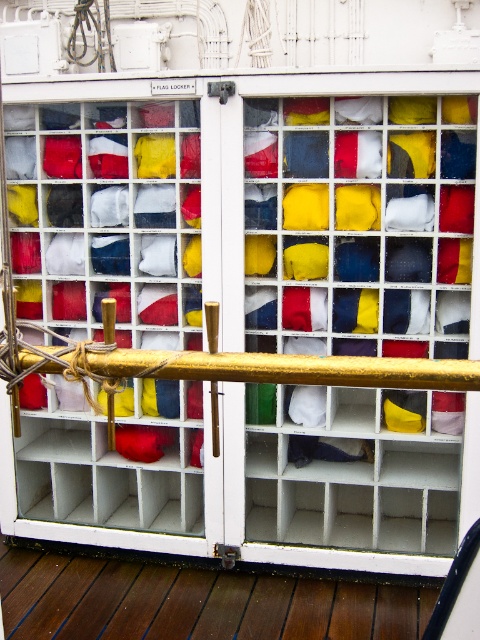
Question: Can you confirm if brown wooden deck at lower center is positioned to the left of gold polished metal rail at center?

Choices:
 (A) no
 (B) yes

Answer: (B)

Question: Is brown wooden deck at lower center in front of gold polished metal rail at center?

Choices:
 (A) no
 (B) yes

Answer: (A)

Question: Is brown wooden deck at lower center closer to camera compared to gold polished metal rail at center?

Choices:
 (A) yes
 (B) no

Answer: (B)

Question: Which object appears closest to the camera in this image?

Choices:
 (A) brown wooden deck at lower center
 (B) gold polished metal rail at center

Answer: (B)

Question: Which point appears closest to the camera in this image?

Choices:
 (A) (436, 365)
 (B) (151, 579)

Answer: (A)